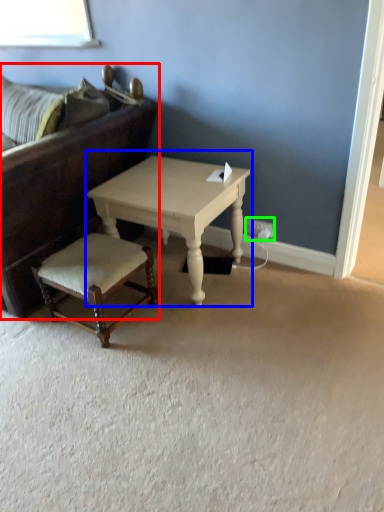
Question: Considering the real-world distances, which object is closest to studio couch (highlighted by a red box)? coffee table (highlighted by a blue box) or electric outlet (highlighted by a green box).

Choices:
 (A) coffee table
 (B) electric outlet

Answer: (A)